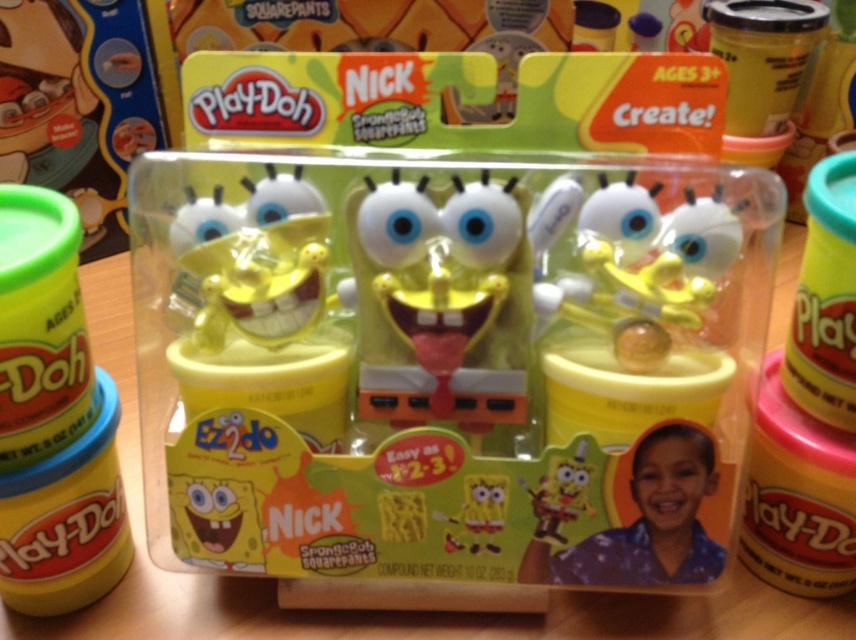
Describe the element at coordinates (654, 518) in the screenshot. The width and height of the screenshot is (856, 640). I see `matte yellow sponge at center` at that location.

Is point (599, 534) less distant than point (455, 536)?

Yes, it is.

Which is behind, point (669, 496) or point (465, 531)?

Positioned behind is point (465, 531).

Where is `matte yellow sponge at center`? matte yellow sponge at center is located at coordinates click(654, 518).